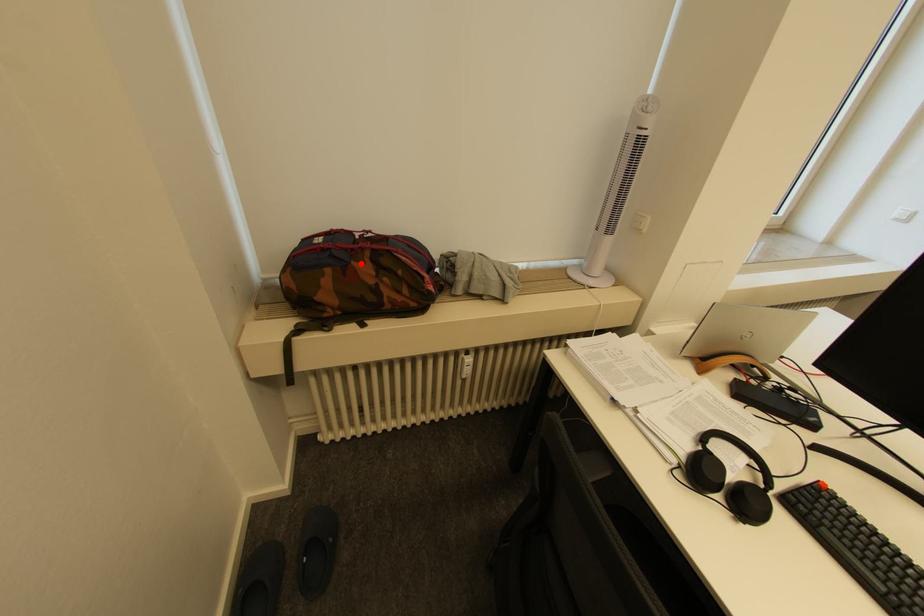
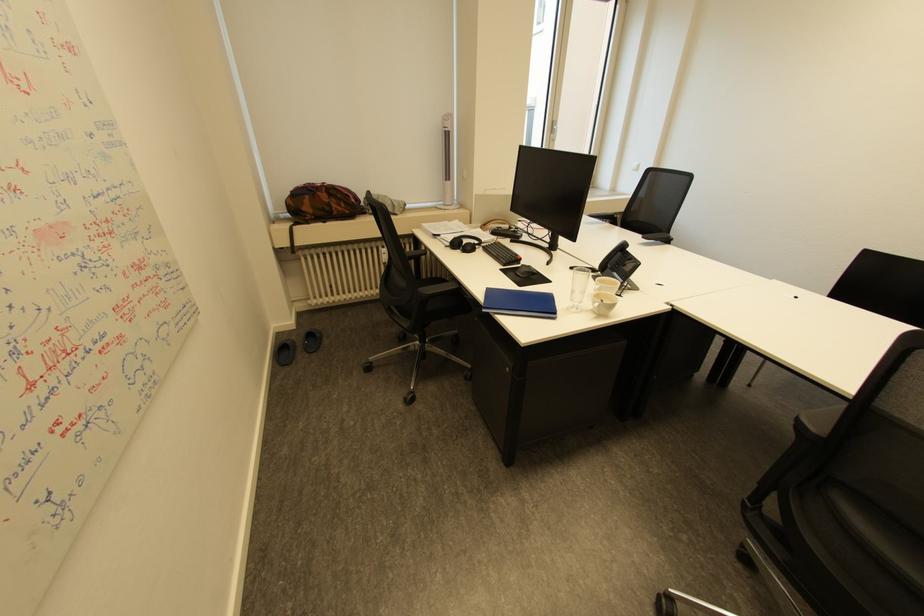
In the second image, find the point that corresponds to the highlighted location in the first image.

(324, 193)